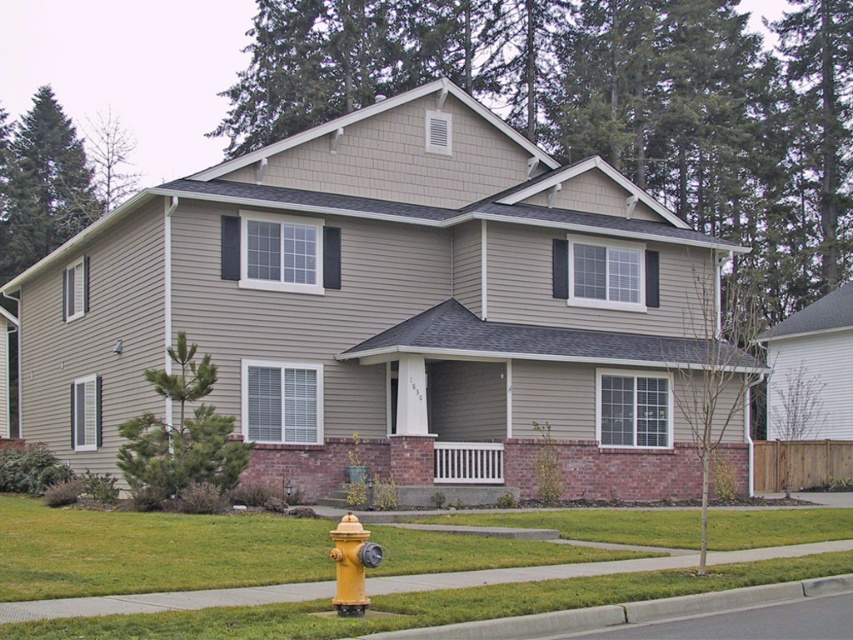
Question: Which object is the farthest from the yellow matte hydrant at lower center?

Choices:
 (A) green grass at lower center
 (B) green leafy tree at upper left
 (C) green leafy tree at center
 (D) green leafy tree at upper center

Answer: (B)

Question: Is green leafy tree at upper center to the right of green textured tree at lower left from the viewer's perspective?

Choices:
 (A) yes
 (B) no

Answer: (A)

Question: Which of the following is the farthest from the observer?

Choices:
 (A) (225, 449)
 (B) (508, 17)

Answer: (B)

Question: Is green leafy tree at upper center closer to camera compared to green textured tree at lower left?

Choices:
 (A) yes
 (B) no

Answer: (B)

Question: Is green leafy tree at upper center smaller than green leafy tree at center?

Choices:
 (A) no
 (B) yes

Answer: (A)

Question: Which point is closer to the camera?

Choices:
 (A) (119, 147)
 (B) (282, 516)

Answer: (B)